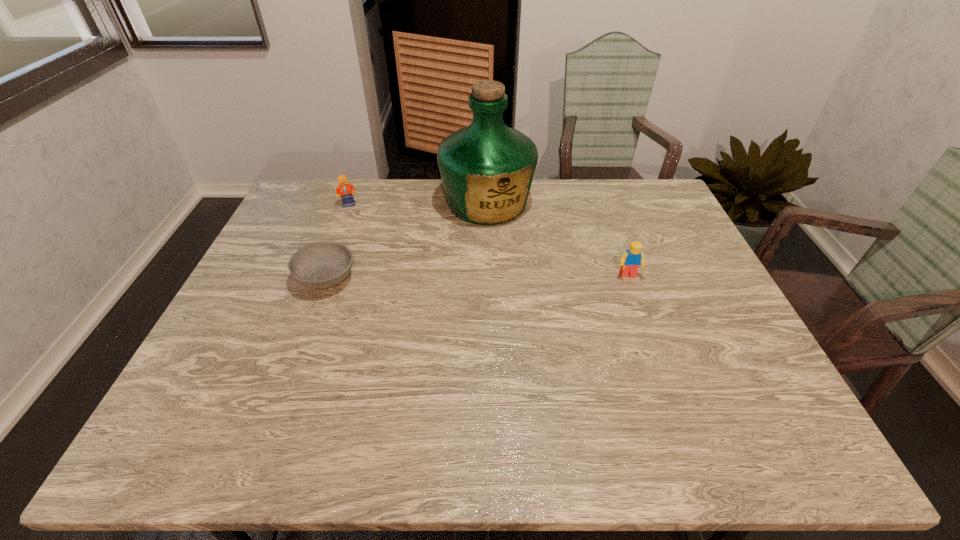
Locate an element on the screen. The image size is (960, 540). free region located on the front-facing side of the left Lego is located at coordinates (378, 227).

You are a GUI agent. You are given a task and a screenshot of the screen. Output one action in this format:
    pyautogui.click(x=<x>, y=<y>)
    Task: Click on the free spot located on the label side of the second object from right to left
    The image size is (960, 540).
    Given the screenshot: What is the action you would take?
    pyautogui.click(x=526, y=298)

This screenshot has height=540, width=960. What are the coordinates of `blank space located on the label side of the second object from right to left` in the screenshot? It's located at (506, 248).

Find the location of a particular element. This screenshot has width=960, height=540. vacant area situated on the label side of the second object from right to left is located at coordinates (514, 268).

The image size is (960, 540). What are the coordinates of `Lego at the far edge` in the screenshot? It's located at (345, 189).

At what (x,y) coordinates should I click in order to perform the action: click on liquor that is at the far edge. Please return your answer as a coordinate pair (x, y). This screenshot has height=540, width=960. Looking at the image, I should click on (487, 168).

In order to click on object present at the left edge in this screenshot , I will do `click(320, 265)`.

Locate an element on the screen. vacant space at the far edge of the desktop is located at coordinates (420, 200).

In the image, there is a desktop. At what (x,y) coordinates should I click in order to perform the action: click on vacant space at the near edge. Please return your answer as a coordinate pair (x, y). The image size is (960, 540). Looking at the image, I should click on (588, 382).

This screenshot has height=540, width=960. I want to click on vacant region at the right edge, so click(640, 220).